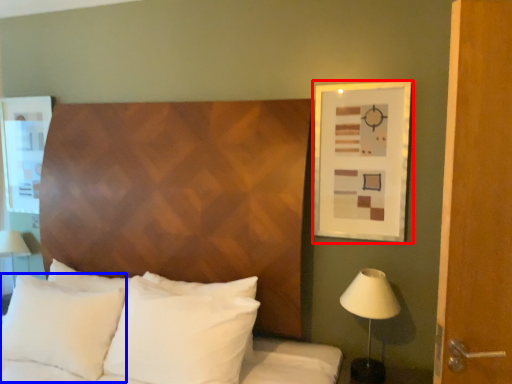
Question: Among these objects, which one is nearest to the camera, picture frame (highlighted by a red box) or pillow (highlighted by a blue box)?

Choices:
 (A) picture frame
 (B) pillow

Answer: (B)